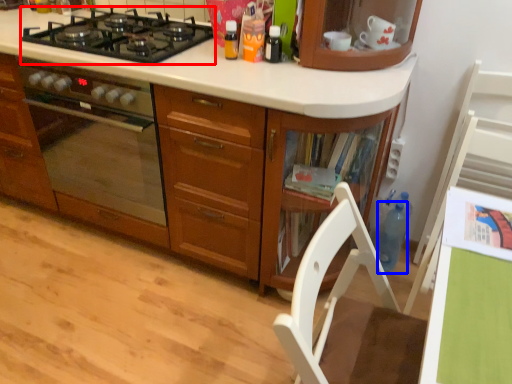
Question: Among these objects, which one is nearest to the camera, gas stove (highlighted by a red box) or bottle (highlighted by a blue box)?

Choices:
 (A) gas stove
 (B) bottle

Answer: (A)